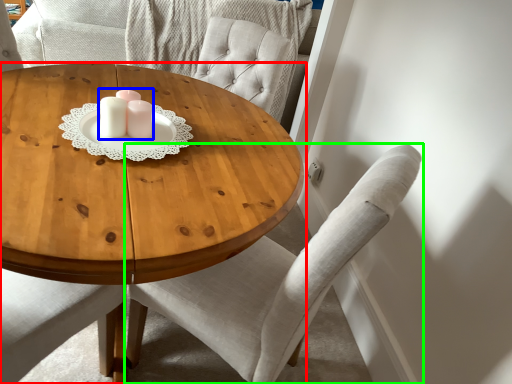
Question: Considering the real-world distances, which object is closest to coffee table (highlighted by a red box)? candle holder (highlighted by a blue box) or chair (highlighted by a green box).

Choices:
 (A) candle holder
 (B) chair

Answer: (A)